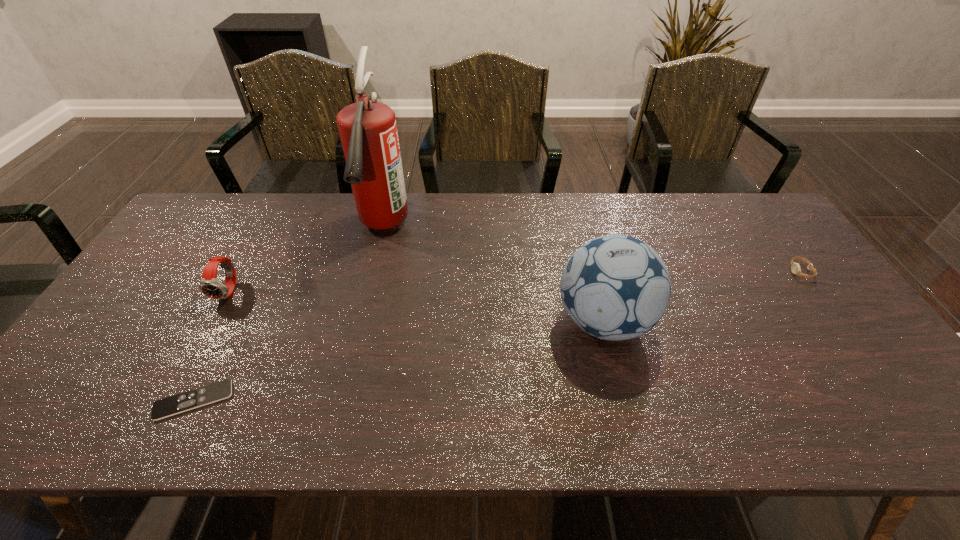
Where is `vacant area between the remote control and the third shortest object`? vacant area between the remote control and the third shortest object is located at coordinates (212, 346).

Image resolution: width=960 pixels, height=540 pixels. In order to click on empty space between the third object from left to right and the shortest object in this screenshot , I will do click(x=288, y=315).

Where is `empty space between the second shortest object and the taller watch`? empty space between the second shortest object and the taller watch is located at coordinates (516, 281).

The image size is (960, 540). What are the coordinates of `free area in between the second object from right to left and the third shortest object` in the screenshot? It's located at (417, 306).

Locate an element on the screen. This screenshot has height=540, width=960. empty space that is in between the second tallest object and the shortest object is located at coordinates (398, 361).

Where is `free space between the left watch and the fire extinguisher`? free space between the left watch and the fire extinguisher is located at coordinates (306, 260).

Locate an element on the screen. empty space between the fire extinguisher and the soccer ball is located at coordinates (493, 275).

Locate an element on the screen. The image size is (960, 540). object that is the second closest one to the soccer ball is located at coordinates (795, 267).

Where is `the third closest object to the shortest object`? The height and width of the screenshot is (540, 960). the third closest object to the shortest object is located at coordinates (615, 287).